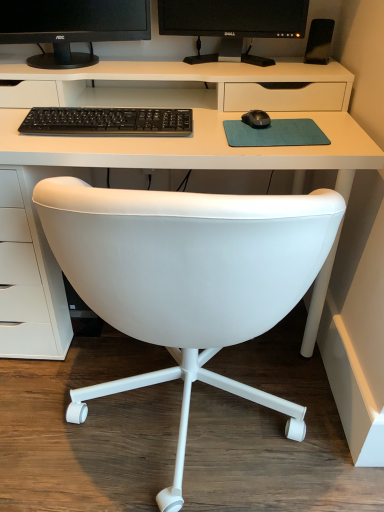
Question: Is black matte monitor at upper center, arranged as the second computer monitor when viewed from the right, in front of or behind black matte keyboard at center in the image?

Choices:
 (A) behind
 (B) front

Answer: (A)

Question: Is black matte monitor at upper center, arranged as the second computer monitor when viewed from the right, to the left or to the right of black matte keyboard at center in the image?

Choices:
 (A) left
 (B) right

Answer: (A)

Question: Estimate the real-world distances between objects in this image. Which object is closer to the white leather chair at center?

Choices:
 (A) teal fabric mousepad at center
 (B) black matte speaker at upper right
 (C) white plastic desk at center
 (D) black matte monitor at upper center, the first computer monitor viewed from the left
 (E) black glossy monitor at upper center, which is the second computer monitor in left-to-right order

Answer: (A)

Question: Which object is the closest to the white leather chair at center?

Choices:
 (A) black matte keyboard at center
 (B) black matte speaker at upper right
 (C) white plastic desk at center
 (D) black glossy monitor at upper center, which ranks as the 1th computer monitor in right-to-left order
 (E) teal fabric mousepad at center

Answer: (E)